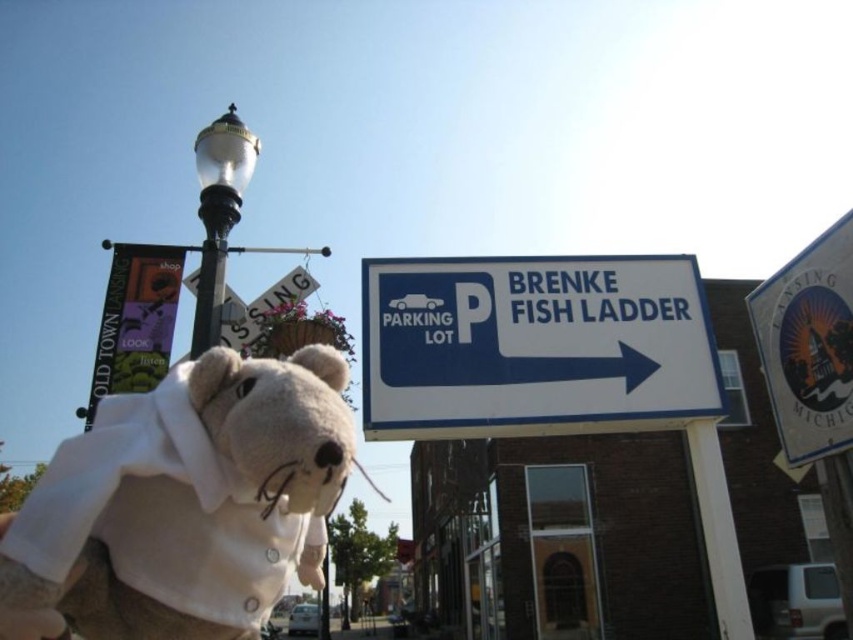
Question: Can you confirm if fluffy beige teddy bear at lower left is bigger than white plastic sign at upper right?

Choices:
 (A) no
 (B) yes

Answer: (A)

Question: Considering the real-world distances, which object is farthest from the white plastic sign at upper right?

Choices:
 (A) polished brass streetlight at upper left
 (B) purple fabric banner at upper left

Answer: (B)

Question: Is the position of fluffy beige teddy bear at lower left more distant than that of blue plastic sign at upper right?

Choices:
 (A) yes
 (B) no

Answer: (B)

Question: Which of the following is the farthest from the observer?

Choices:
 (A) (120, 602)
 (B) (815, 358)
 (C) (94, 401)

Answer: (C)

Question: Which object is the farthest from the white plastic sign at upper right?

Choices:
 (A) purple fabric banner at upper left
 (B) blue plastic sign at upper right
 (C) polished brass streetlight at upper left

Answer: (A)

Question: Is white plastic sign at upper right thinner than polished brass streetlight at upper left?

Choices:
 (A) no
 (B) yes

Answer: (A)